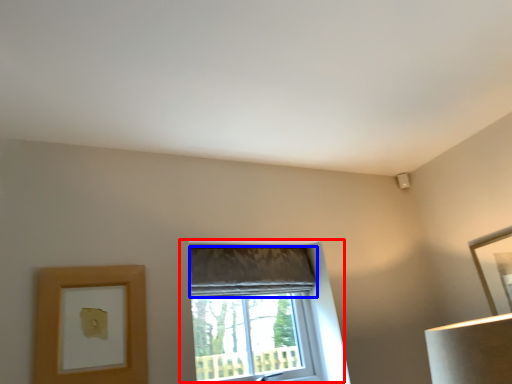
Question: Which point is further to the camera, window (highlighted by a red box) or curtain (highlighted by a blue box)?

Choices:
 (A) window
 (B) curtain

Answer: (B)